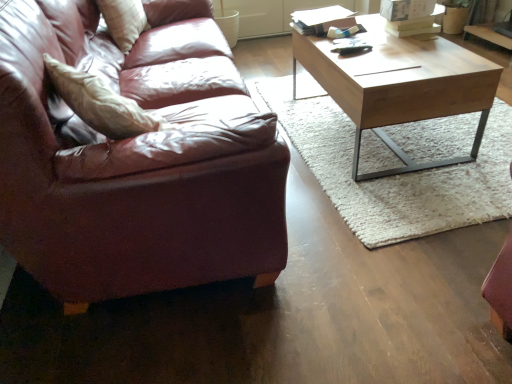
This screenshot has width=512, height=384. I want to click on free space above light brown wood coffee table at center (from a real-world perspective), so click(366, 49).